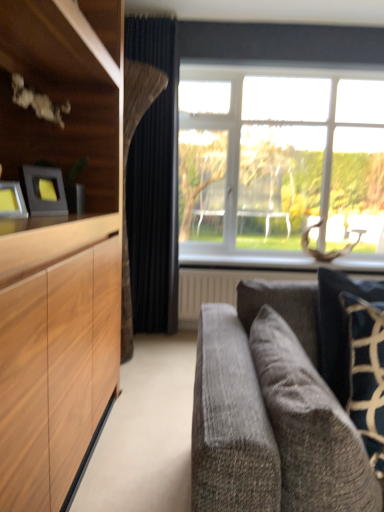
What do you see at coordinates (44, 191) in the screenshot? I see `matte black picture frame at left, placed as the first picture frame when sorted from back to front` at bounding box center [44, 191].

The width and height of the screenshot is (384, 512). What do you see at coordinates (339, 327) in the screenshot?
I see `velvet dark blue pillow at right` at bounding box center [339, 327].

Measure the distance between velvet gray couch at lower right and camera.

They are 29.67 inches apart.

Where is `matte black picture frame at left, placed as the first picture frame when sorted from back to front`? matte black picture frame at left, placed as the first picture frame when sorted from back to front is located at coordinates (44, 191).

Considering the positions of objects clear glass window at center and dark blue velvet curtain at center in the image provided, who is more to the left, clear glass window at center or dark blue velvet curtain at center?

Positioned to the left is dark blue velvet curtain at center.

Relative to dark blue velvet curtain at center, is clear glass window at center in front or behind?

In the image, clear glass window at center appears behind dark blue velvet curtain at center.

What's the angular difference between clear glass window at center and dark blue velvet curtain at center's facing directions?

They differ by 0.0585 degrees in their facing directions.

From a real-world perspective, is clear glass window at center over dark blue velvet curtain at center?

Yes.

Identify the location of picture frame that appears above the metallic silver picture frame at left, positioned as the first picture frame in front-to-back order (from the image's perspective). The image size is (384, 512). (44, 191).

Can you confirm if matte black picture frame at left, placed as the first picture frame when sorted from back to front, is positioned to the left of metallic silver picture frame at left, which is the 2th picture frame in back-to-front order?

No, matte black picture frame at left, placed as the first picture frame when sorted from back to front, is not to the left of metallic silver picture frame at left, which is the 2th picture frame in back-to-front order.

Is matte black picture frame at left, which is the second picture frame from front to back, located outside metallic silver picture frame at left, which is the 2th picture frame in back-to-front order?

Yes.

Is matte black picture frame at left, placed as the first picture frame when sorted from back to front, positioned in front of metallic silver picture frame at left, which is the 2th picture frame in back-to-front order?

No, the depth of matte black picture frame at left, placed as the first picture frame when sorted from back to front, is greater than that of metallic silver picture frame at left, which is the 2th picture frame in back-to-front order.

Relative to matte black picture frame at left, which is the second picture frame from front to back, is white textured radiator at lower center in front or behind?

white textured radiator at lower center is behind matte black picture frame at left, which is the second picture frame from front to back.

Is white textured radiator at lower center far away from matte black picture frame at left, which is the second picture frame from front to back?

Yes, white textured radiator at lower center and matte black picture frame at left, which is the second picture frame from front to back, are quite far apart.

Find the location of a particular element. The width and height of the screenshot is (384, 512). the 2nd picture frame positioned above the white textured radiator at lower center (from a real-world perspective) is located at coordinates (44, 191).

From the picture: Would you say matte black picture frame at left, which is the second picture frame from front to back, is inside or outside clear glass window at center?

matte black picture frame at left, which is the second picture frame from front to back, lies outside clear glass window at center.

Is matte black picture frame at left, placed as the first picture frame when sorted from back to front, not near clear glass window at center?

Yes, matte black picture frame at left, placed as the first picture frame when sorted from back to front, is far from clear glass window at center.

From the image's perspective, who appears lower, matte black picture frame at left, which is the second picture frame from front to back, or clear glass window at center?

matte black picture frame at left, which is the second picture frame from front to back, appears lower in the image.

Does point (48, 200) lie behind point (329, 307)?

Yes, point (48, 200) is behind point (329, 307).

Considering the positions of objects matte black picture frame at left, which is the second picture frame from front to back, and velvet dark blue pillow at right in the image provided, who is in front, matte black picture frame at left, which is the second picture frame from front to back, or velvet dark blue pillow at right?

velvet dark blue pillow at right is in front.

From a real-world perspective, does matte black picture frame at left, placed as the first picture frame when sorted from back to front, stand above velvet dark blue pillow at right?

Yes.

Could you tell me if velvet dark blue pillow at right is facing metallic silver picture frame at left, which is the 2th picture frame in back-to-front order?

No.

I want to click on pillow in front of the metallic silver picture frame at left, which is the 2th picture frame in back-to-front order, so click(x=339, y=327).

Considering the relative sizes of velvet dark blue pillow at right and metallic silver picture frame at left, positioned as the first picture frame in front-to-back order, in the image provided, is velvet dark blue pillow at right bigger than metallic silver picture frame at left, positioned as the first picture frame in front-to-back order,?

Correct, velvet dark blue pillow at right is larger in size than metallic silver picture frame at left, positioned as the first picture frame in front-to-back order.

Does velvet dark blue pillow at right have a lesser width compared to metallic silver picture frame at left, which is the 2th picture frame in back-to-front order?

In fact, velvet dark blue pillow at right might be wider than metallic silver picture frame at left, which is the 2th picture frame in back-to-front order.

From the image's perspective, is white textured radiator at lower center located beneath clear glass window at center?

Correct, white textured radiator at lower center appears lower than clear glass window at center in the image.

Looking at this image, is white textured radiator at lower center spatially inside clear glass window at center, or outside of it?

white textured radiator at lower center is outside clear glass window at center.

Consider the image. How far apart are white textured radiator at lower center and clear glass window at center?

They are 32.28 inches apart.

Considering the relative sizes of white textured radiator at lower center and clear glass window at center in the image provided, is white textured radiator at lower center taller than clear glass window at center?

No.

This screenshot has width=384, height=512. I want to click on window above the dark blue velvet curtain at center (from the image's perspective), so click(x=280, y=164).

You are a GUI agent. You are given a task and a screenshot of the screen. Output one action in this format:
    pyautogui.click(x=<x>, y=<y>)
    Task: Click on the picture frame beneath the matte black picture frame at left, placed as the first picture frame when sorted from back to front (from a real-world perspective)
    The image size is (384, 512).
    Given the screenshot: What is the action you would take?
    pyautogui.click(x=12, y=201)

Looking at the image, which one is located further to matte black picture frame at left, which is the second picture frame from front to back, dark blue velvet curtain at center or white textured radiator at lower center?

white textured radiator at lower center is positioned further to the anchor matte black picture frame at left, which is the second picture frame from front to back.

Considering their positions, is velvet dark blue pillow at right positioned further to clear glass window at center than metallic silver picture frame at left, positioned as the first picture frame in front-to-back order?

Based on the image, metallic silver picture frame at left, positioned as the first picture frame in front-to-back order, appears to be further to clear glass window at center.

Based on the photo, looking at the image, which one is located further to velvet dark blue pillow at right, metallic silver picture frame at left, positioned as the first picture frame in front-to-back order, or clear glass window at center?

The object further to velvet dark blue pillow at right is clear glass window at center.

Looking at the image, which one is located further to clear glass window at center, dark blue velvet curtain at center or matte black picture frame at left, which is the second picture frame from front to back?

matte black picture frame at left, which is the second picture frame from front to back, is positioned further to the anchor clear glass window at center.

Considering their positions, is white textured radiator at lower center positioned closer to clear glass window at center than matte black picture frame at left, which is the second picture frame from front to back?

The object closer to clear glass window at center is white textured radiator at lower center.

Which object lies nearer to the anchor point dark blue velvet curtain at center, velvet gray couch at lower right or metallic silver picture frame at left, which is the 2th picture frame in back-to-front order?

metallic silver picture frame at left, which is the 2th picture frame in back-to-front order.

Which object lies further to the anchor point white textured radiator at lower center, clear glass window at center or velvet gray couch at lower right?

velvet gray couch at lower right is further to white textured radiator at lower center.

Based on their spatial positions, is clear glass window at center or matte black picture frame at left, placed as the first picture frame when sorted from back to front, further from dark blue velvet curtain at center?

matte black picture frame at left, placed as the first picture frame when sorted from back to front, lies further to dark blue velvet curtain at center than the other object.

The height and width of the screenshot is (512, 384). I want to click on window between matte black picture frame at left, placed as the first picture frame when sorted from back to front, and white textured radiator at lower center, along the z-axis, so click(x=280, y=164).

Locate an element on the screen. The width and height of the screenshot is (384, 512). curtain positioned between velvet gray couch at lower right and white textured radiator at lower center from near to far is located at coordinates (151, 180).

The image size is (384, 512). Find the location of `pillow located between velvet gray couch at lower right and clear glass window at center in the depth direction`. pillow located between velvet gray couch at lower right and clear glass window at center in the depth direction is located at coordinates (339, 327).

Find the location of `radiator between dark blue velvet curtain at center and clear glass window at center in the horizontal direction`. radiator between dark blue velvet curtain at center and clear glass window at center in the horizontal direction is located at coordinates (221, 287).